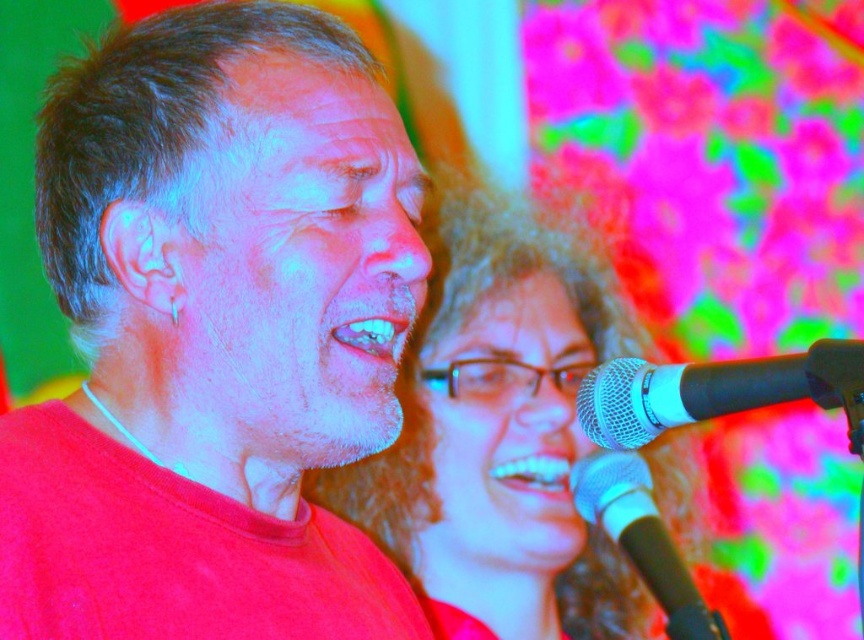
Does matte red shirt at center have a larger size compared to matte plastic hair at center?

Actually, matte red shirt at center might be smaller than matte plastic hair at center.

Does matte red shirt at center have a lesser height compared to matte plastic hair at center?

Yes, matte red shirt at center is shorter than matte plastic hair at center.

Is point (329, 92) positioned after point (518, 344)?

No, it is in front of (518, 344).

Identify the location of matte red shirt at center. Image resolution: width=864 pixels, height=640 pixels. (213, 336).

Describe the element at coordinates (716, 392) in the screenshot. The image size is (864, 640). I see `black matte microphone at lower right` at that location.

Describe the element at coordinates (716, 392) in the screenshot. I see `black matte microphone at lower right` at that location.

Where is `black matte microphone at lower right`? black matte microphone at lower right is located at coordinates (716, 392).

At what (x,y) coordinates should I click in order to perform the action: click on matte plastic hair at center. Please return your answer as a coordinate pair (x, y). Image resolution: width=864 pixels, height=640 pixels. Looking at the image, I should click on (499, 426).

Where is `matte plastic hair at center`? This screenshot has height=640, width=864. matte plastic hair at center is located at coordinates (499, 426).